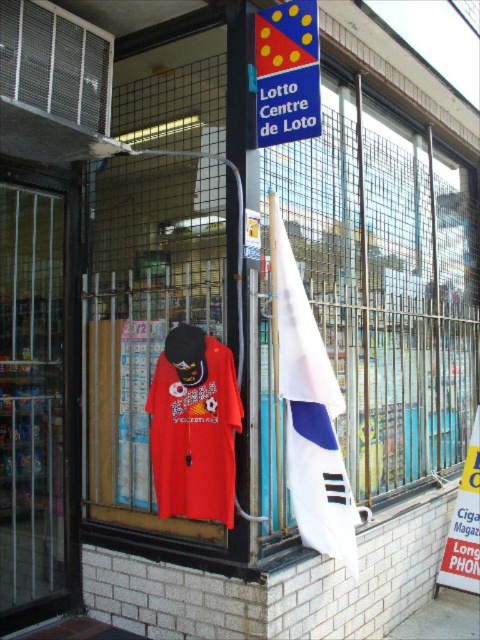
Question: Which of these objects is positioned closest to the matte red t-shirt at center?

Choices:
 (A) blue plastic sign at upper center
 (B) transparent glass door at left

Answer: (B)

Question: Is white fabric flag at center positioned behind matte red t-shirt at center?

Choices:
 (A) no
 (B) yes

Answer: (B)

Question: Which point is farther to the camera?

Choices:
 (A) transparent glass door at left
 (B) blue plastic sign at upper center
 (C) matte red t-shirt at center
 (D) white paper sign at lower right

Answer: (D)

Question: Can you confirm if transparent glass door at left is thinner than white fabric flag at center?

Choices:
 (A) no
 (B) yes

Answer: (A)

Question: Can you confirm if transparent glass door at left is bigger than white paper sign at lower right?

Choices:
 (A) yes
 (B) no

Answer: (A)

Question: Which of the following is the closest to the observer?

Choices:
 (A) (279, 211)
 (B) (476, 456)

Answer: (A)